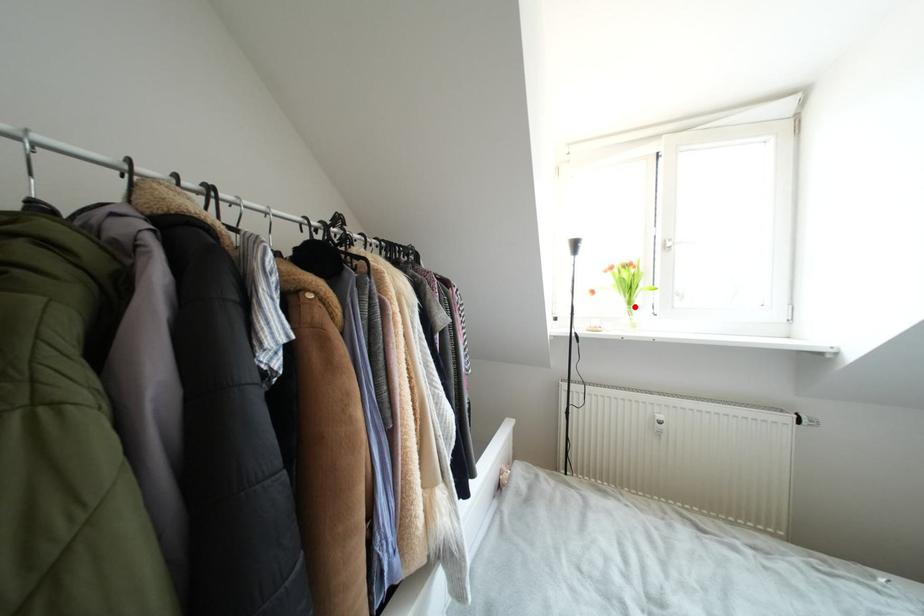
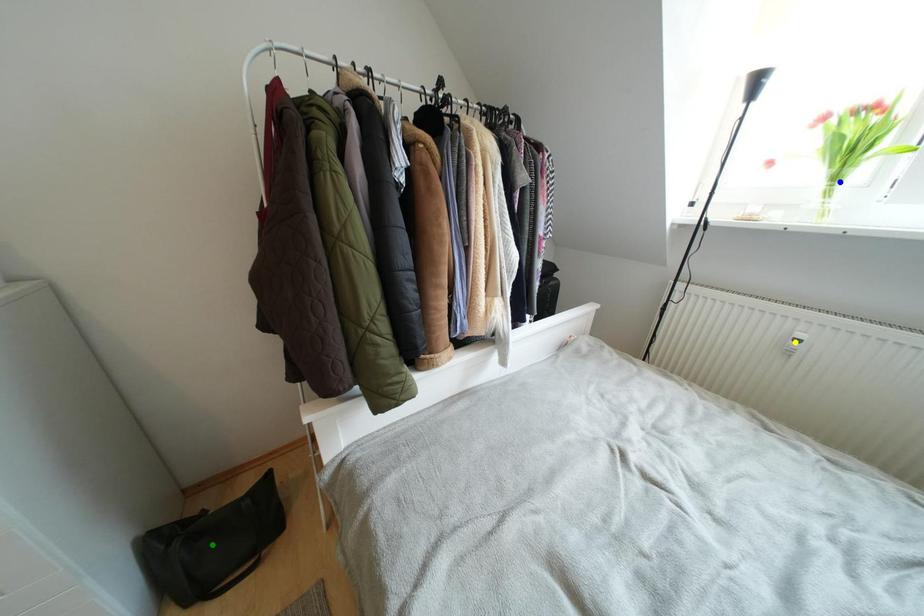
Question: I am providing you with two images of the same scene from different viewpoints. A red point is marked on the first image. You are given multiple points on the second image. Which point in image 2 represents the same 3d spot as the red point in image 1?

Choices:
 (A) green point
 (B) blue point
 (C) yellow point

Answer: (B)